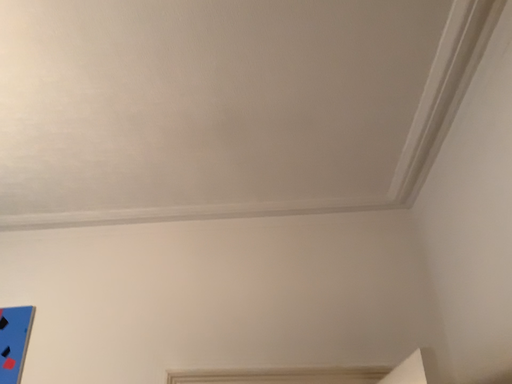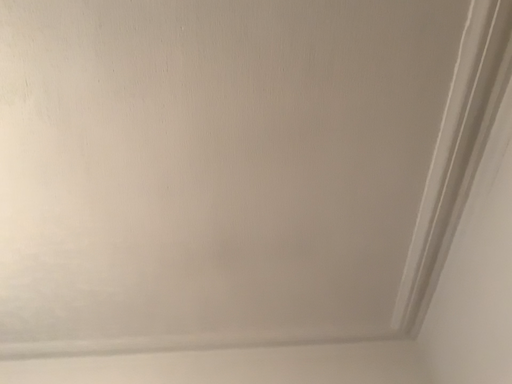
Question: Which way did the camera rotate in the video?

Choices:
 (A) rotated upward
 (B) rotated downward

Answer: (A)